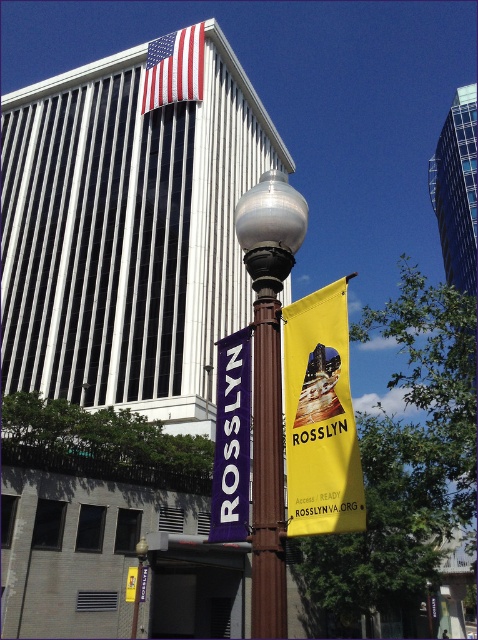
Question: Which point is farther to the camera?

Choices:
 (A) polished brass street light at center
 (B) purple fabric banner at center

Answer: (B)

Question: Among these points, which one is nearest to the camera?

Choices:
 (A) (217, 513)
 (B) (261, 416)
 (C) (259, 397)
 (D) (300, 392)

Answer: (D)

Question: Is brown polished metal pole at center below purple fabric banner at center?

Choices:
 (A) no
 (B) yes

Answer: (B)

Question: Which object is closer to the camera taking this photo?

Choices:
 (A) polished brass street light at center
 (B) brown polished metal pole at center

Answer: (B)

Question: Does yellow fabric banner at center have a larger size compared to american flag at upper center?

Choices:
 (A) yes
 (B) no

Answer: (B)

Question: Is polished brass street light at center closer to camera compared to brown polished metal pole at center?

Choices:
 (A) yes
 (B) no

Answer: (B)